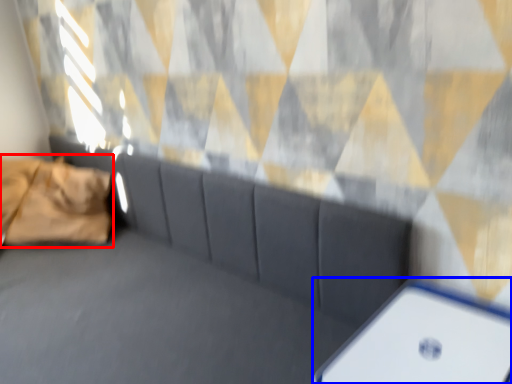
Question: Among these objects, which one is nearest to the camera, pillow (highlighted by a red box) or furniture (highlighted by a blue box)?

Choices:
 (A) pillow
 (B) furniture

Answer: (B)